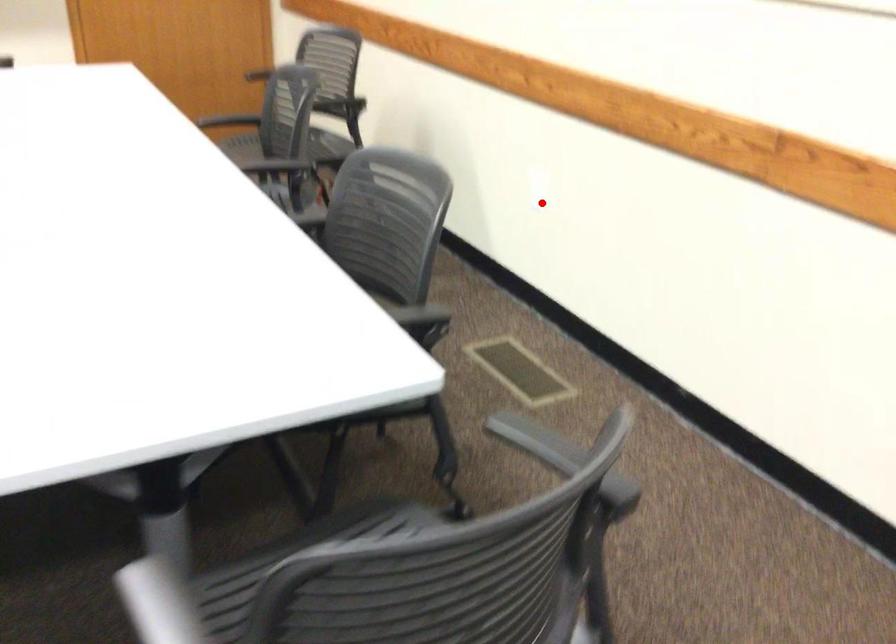
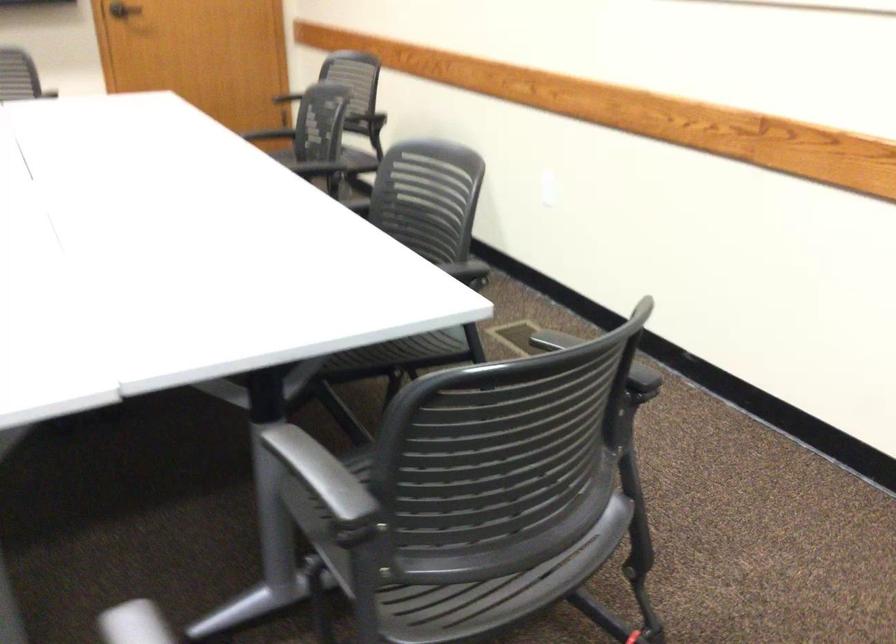
Find the pixel in the second image that matches the highlighted location in the first image.

(547, 196)